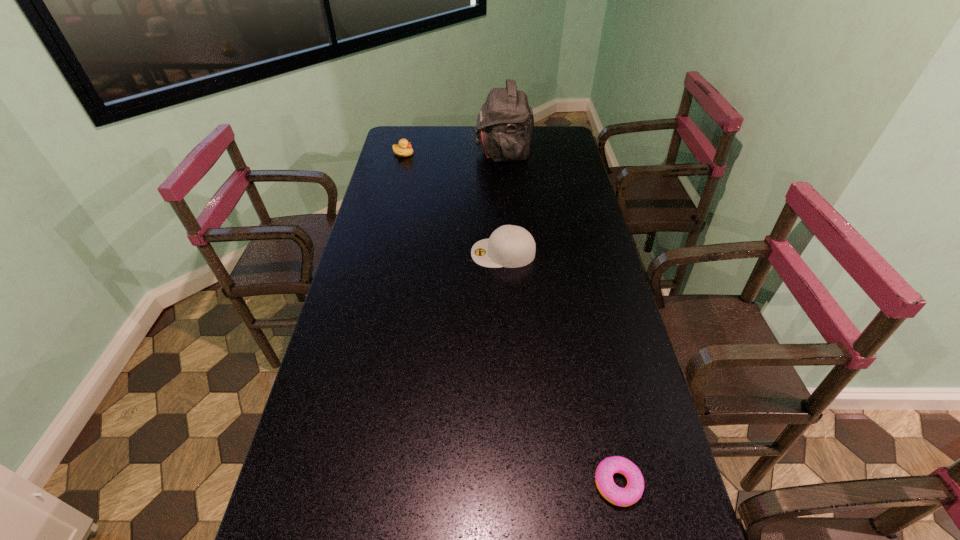
The image size is (960, 540). I want to click on vacant space located 0.300m on the front-facing side of the third farthest object, so click(380, 253).

Where is `vacant space positioned 0.150m on the front-facing side of the third farthest object`? vacant space positioned 0.150m on the front-facing side of the third farthest object is located at coordinates coord(426,253).

The height and width of the screenshot is (540, 960). In order to click on free space located on the front-facing side of the third farthest object in this screenshot , I will do `click(453, 253)`.

You are a GUI agent. You are given a task and a screenshot of the screen. Output one action in this format:
    pyautogui.click(x=<x>, y=<y>)
    Task: Click on the vacant space located 0.110m at the face of the second shortest object
    
    Given the screenshot: What is the action you would take?
    pyautogui.click(x=439, y=153)

Where is `vacant space located 0.140m on the back of the doughnut`? The height and width of the screenshot is (540, 960). vacant space located 0.140m on the back of the doughnut is located at coordinates (600, 402).

Find the location of `shoulder bag present at the far edge`. shoulder bag present at the far edge is located at coordinates (x=505, y=124).

The width and height of the screenshot is (960, 540). What are the coordinates of `duckling that is at the far edge` in the screenshot? It's located at (404, 149).

What are the coordinates of `object located in the left edge section of the desktop` in the screenshot? It's located at (404, 149).

Find the location of a particular element. Image resolution: width=960 pixels, height=540 pixels. object that is positioned at the right edge is located at coordinates (623, 497).

The height and width of the screenshot is (540, 960). What are the coordinates of `object present at the far left corner` in the screenshot? It's located at (404, 149).